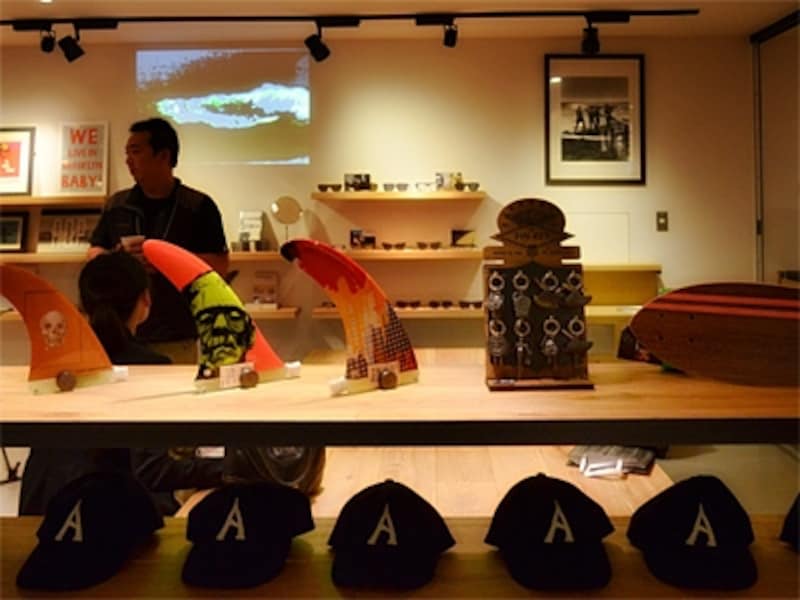
This screenshot has width=800, height=600. Find the location of `mirror`. mirror is located at coordinates (281, 211).